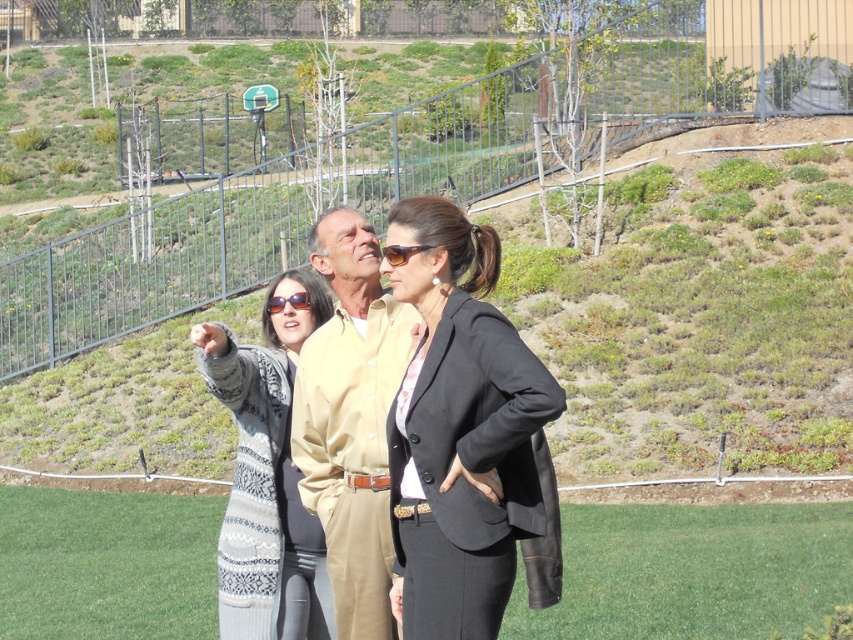
What do you see at coordinates (267, 477) in the screenshot?
I see `knitted gray sweater at center` at bounding box center [267, 477].

This screenshot has width=853, height=640. Find the location of `knitted gray sweater at center`. knitted gray sweater at center is located at coordinates (267, 477).

Who is more forward, (379, 618) or (216, 346)?

Point (379, 618) is more forward.

Is tan cotton shirt at center to the right of knitted gray sweater at center from the viewer's perspective?

Indeed, tan cotton shirt at center is positioned on the right side of knitted gray sweater at center.

Is point (340, 317) positioned in front of point (250, 451)?

Yes, it is.

Identify the location of tan cotton shirt at center. (351, 420).

Is matte black sunglasses at center smaller than matte brown sunglasses at center?

Yes.

Looking at this image, which of these two, matte black sunglasses at center or matte brown sunglasses at center, stands shorter?

matte brown sunglasses at center is shorter.

Is point (286, 300) farther from viewer compared to point (392, 246)?

Yes, point (286, 300) is behind point (392, 246).

Locate an element on the screen. Image resolution: width=853 pixels, height=640 pixels. matte black sunglasses at center is located at coordinates click(x=288, y=301).